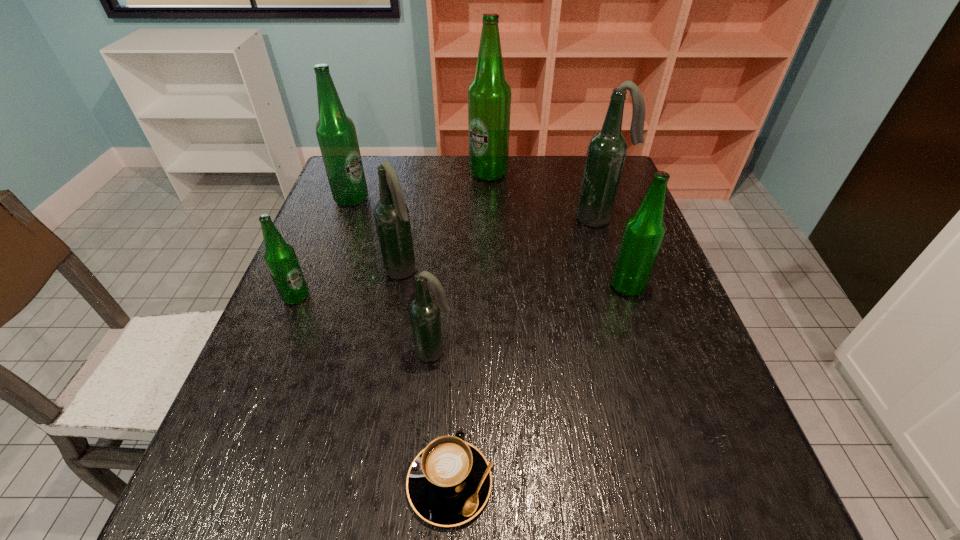
Find the location of `the second nearest object`. the second nearest object is located at coordinates (424, 310).

Where is `the fourth beer bottle from left to right`? This screenshot has height=540, width=960. the fourth beer bottle from left to right is located at coordinates (424, 310).

Where is `the shortest object`? This screenshot has height=540, width=960. the shortest object is located at coordinates (449, 482).

Identify the location of black cappuccino. The width and height of the screenshot is (960, 540). (449, 482).

Find the location of a particular element. free location located on the label of the third green beer bottle from left to right is located at coordinates click(490, 240).

Find the location of `vacant space positioned 0.110m on the label of the second farthest object`. vacant space positioned 0.110m on the label of the second farthest object is located at coordinates (407, 199).

This screenshot has height=540, width=960. Identify the location of vacant area located 0.220m on the back of the biggest dark beer bottle. click(x=584, y=169).

You are a GUI agent. You are given a task and a screenshot of the screen. Output one action in this format:
    pyautogui.click(x=<x>, y=<y>)
    Task: Click on the vacant space located 0.260m on the right of the second farthest dark beer bottle
    
    Given the screenshot: What is the action you would take?
    pyautogui.click(x=526, y=272)

This screenshot has height=540, width=960. Identify the location of vacant point located on the label of the second smallest green beer bottle. (588, 286).

In order to click on vacant position located on the label of the second smallest green beer bottle in this screenshot , I will do `click(575, 286)`.